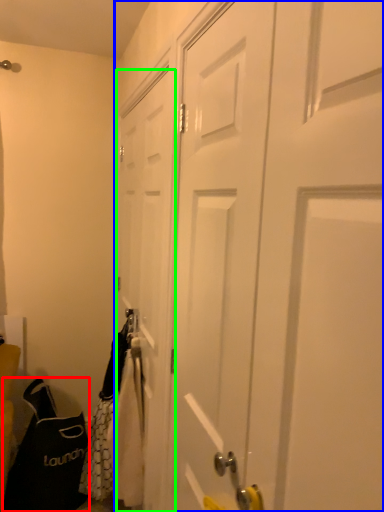
Question: Which is nearer to the shoulder bag (highlighted by a red box)? door (highlighted by a blue box) or door (highlighted by a green box).

Choices:
 (A) door
 (B) door

Answer: (B)